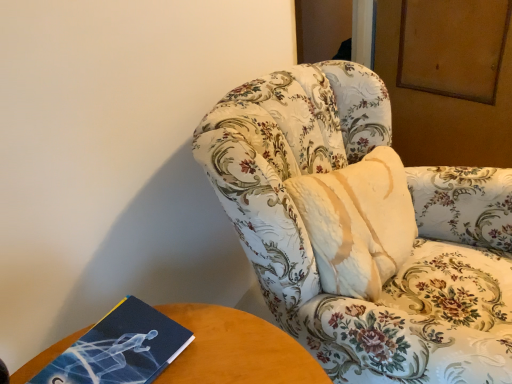
Question: Is blue matte book at lower left in front of or behind floral-patterned fabric chair at center in the image?

Choices:
 (A) behind
 (B) front

Answer: (A)

Question: Is blue matte book at lower left bigger or smaller than floral-patterned fabric chair at center?

Choices:
 (A) big
 (B) small

Answer: (B)

Question: From a real-world perspective, is blue matte book at lower left positioned above or below floral-patterned fabric chair at center?

Choices:
 (A) below
 (B) above

Answer: (B)

Question: Visually, is floral-patterned fabric chair at center positioned to the left or to the right of blue matte book at lower left?

Choices:
 (A) left
 (B) right

Answer: (B)

Question: From the image's perspective, is floral-patterned fabric chair at center located above or below blue matte book at lower left?

Choices:
 (A) below
 (B) above

Answer: (B)

Question: Is floral-patterned fabric chair at center taller or shorter than blue matte book at lower left?

Choices:
 (A) short
 (B) tall

Answer: (B)

Question: In terms of width, does floral-patterned fabric chair at center look wider or thinner when compared to blue matte book at lower left?

Choices:
 (A) thin
 (B) wide

Answer: (B)